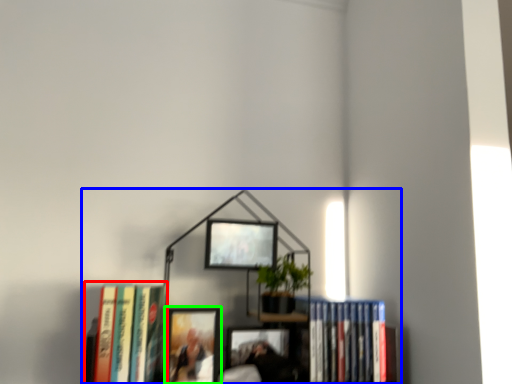
Question: Which is nearer to the book (highlighted by a red box)? bookcase (highlighted by a blue box) or picture frame (highlighted by a green box).

Choices:
 (A) bookcase
 (B) picture frame

Answer: (B)